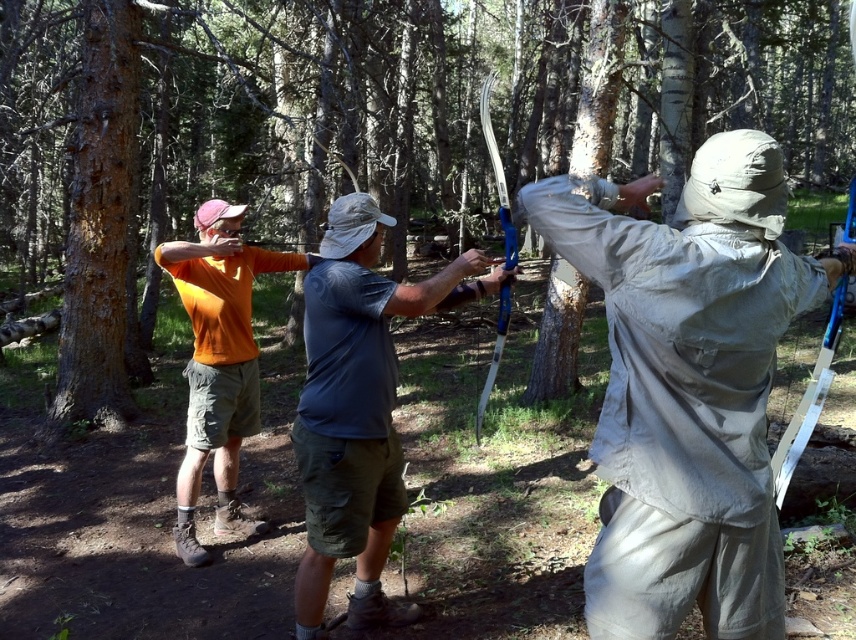
Question: Can you confirm if gray fabric shirt at center is positioned to the right of orange cotton shirt at left?

Choices:
 (A) no
 (B) yes

Answer: (B)

Question: Which object is the closest to the orange cotton shirt at left?

Choices:
 (A) gray fabric shirt at center
 (B) khaki fabric jacket at center

Answer: (A)

Question: Which is farther from the brown rough tree at center?

Choices:
 (A) gray fabric shirt at center
 (B) khaki fabric jacket at center
 (C) orange cotton shirt at left

Answer: (A)

Question: Is brown rough tree at center thinner than orange cotton shirt at left?

Choices:
 (A) no
 (B) yes

Answer: (A)

Question: Based on their relative distances, which object is nearer to the brown rough tree at center?

Choices:
 (A) khaki fabric jacket at center
 (B) orange cotton shirt at left
 (C) gray fabric shirt at center

Answer: (A)

Question: Does brown rough tree at center appear on the right side of gray fabric shirt at center?

Choices:
 (A) no
 (B) yes

Answer: (B)